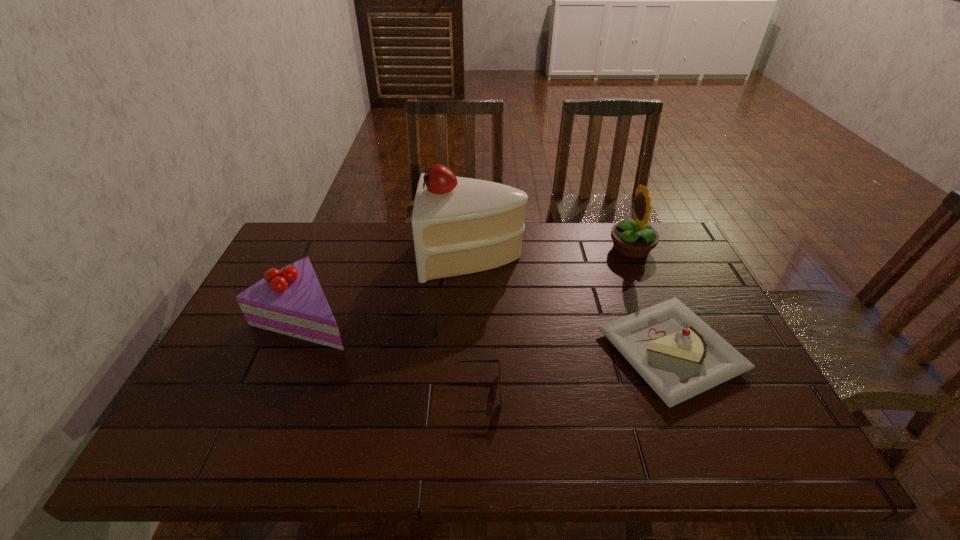
Where is `the tallest object`? Image resolution: width=960 pixels, height=540 pixels. the tallest object is located at coordinates (460, 225).

The height and width of the screenshot is (540, 960). In order to click on the farthest cake in this screenshot , I will do `click(460, 225)`.

The width and height of the screenshot is (960, 540). Find the location of `sunflower`. sunflower is located at coordinates (632, 239).

At what (x,y) coordinates should I click in order to perform the action: click on the second shortest cake. Please return your answer as a coordinate pair (x, y). Image resolution: width=960 pixels, height=540 pixels. Looking at the image, I should click on (290, 301).

Where is `the third shortest object`? the third shortest object is located at coordinates (290, 301).

What are the coordinates of `the second shortest object` in the screenshot? It's located at (679, 356).

What are the coordinates of `the rightmost cake` in the screenshot? It's located at (679, 356).

Locate an element on the screen. Image resolution: width=960 pixels, height=540 pixels. the shortest object is located at coordinates (473, 361).

Where is `free spot located 0.360m on the right of the tallest object`? Image resolution: width=960 pixels, height=540 pixels. free spot located 0.360m on the right of the tallest object is located at coordinates (636, 255).

In order to click on vacant region located 0.050m on the face of the fourth shortest object in this screenshot , I will do `click(593, 248)`.